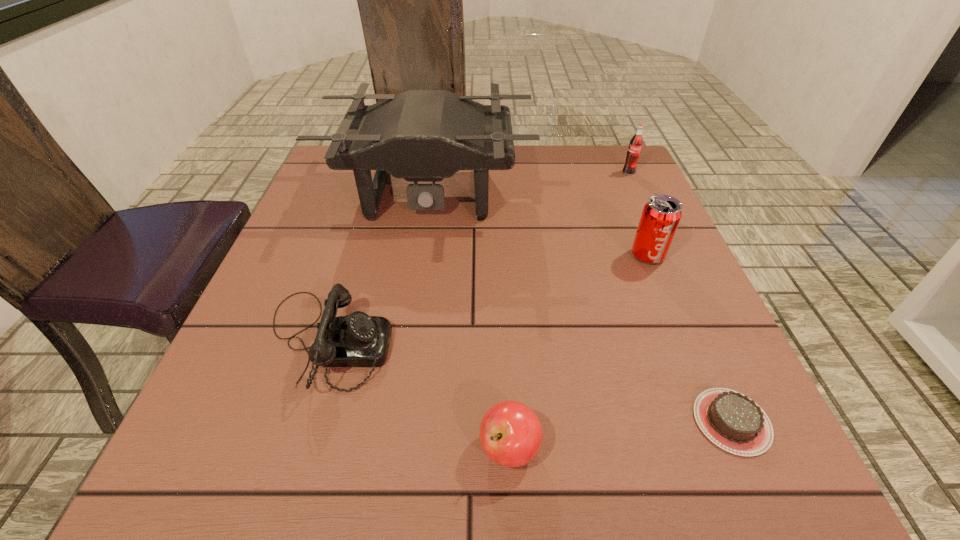
This screenshot has height=540, width=960. Find the location of `the tallest object`. the tallest object is located at coordinates coord(420,135).

Find the location of `the nearer soda bottle`. the nearer soda bottle is located at coordinates (661, 215).

Image resolution: width=960 pixels, height=540 pixels. Identify the location of the farther soda bottle. (634, 150).

Image resolution: width=960 pixels, height=540 pixels. What are the coordinates of `telephone` in the screenshot? It's located at (356, 340).

Find the location of a particular element. The image size is (960, 540). apple is located at coordinates (510, 433).

Where is `the shortest object`? The image size is (960, 540). the shortest object is located at coordinates (731, 420).

Locate an element on the screen. Image resolution: width=960 pixels, height=540 pixels. vacant space located with a camera mounted on the underside of the tallest object is located at coordinates (399, 404).

Where is `free space located on the front of the fourth nearest object`? free space located on the front of the fourth nearest object is located at coordinates (677, 326).

The image size is (960, 540). I want to click on vacant space located on the label of the farther soda bottle, so click(636, 188).

This screenshot has height=540, width=960. Identify the location of free space located on the front-facing side of the telephone. (465, 342).